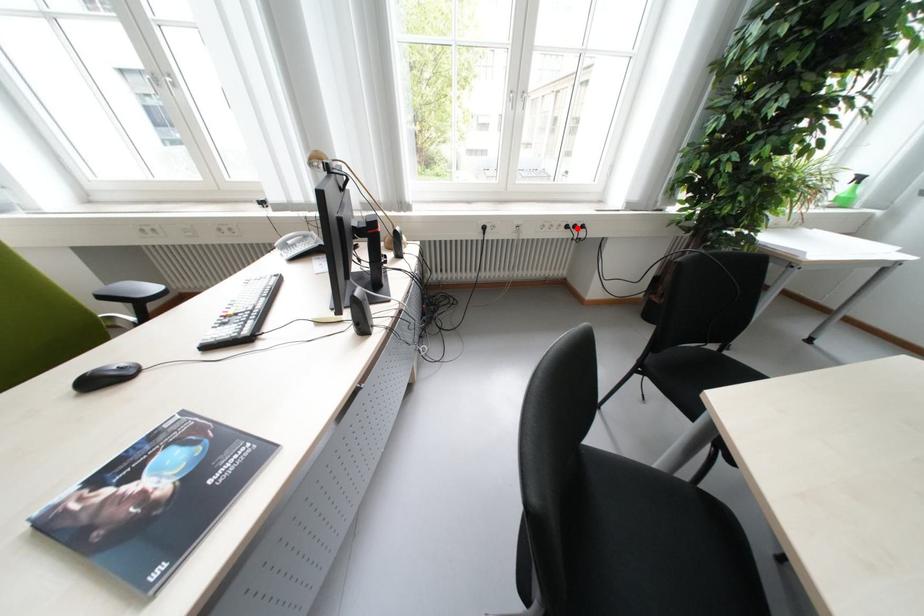
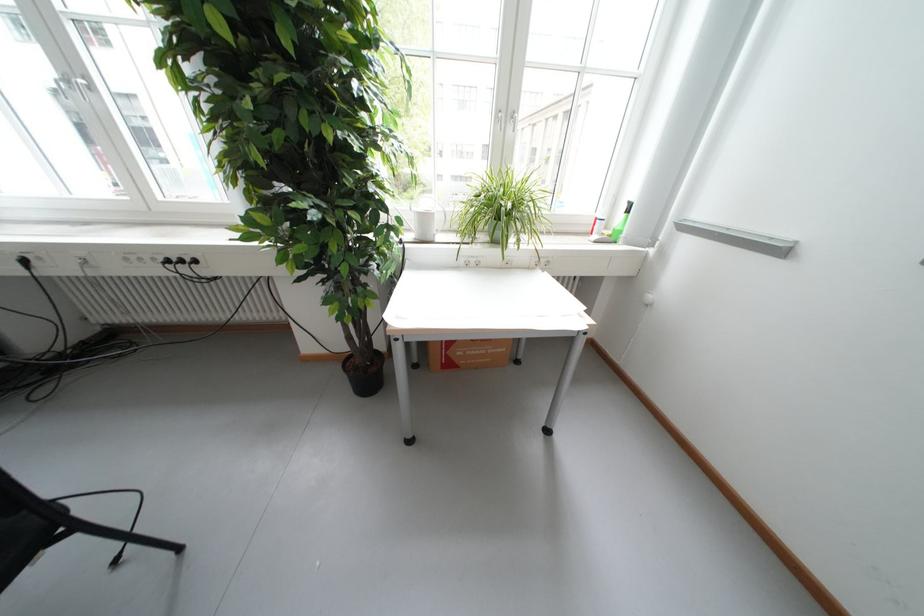
The point at the highlighted location is marked in the first image. Where is the corresponding point in the second image?

(177, 262)